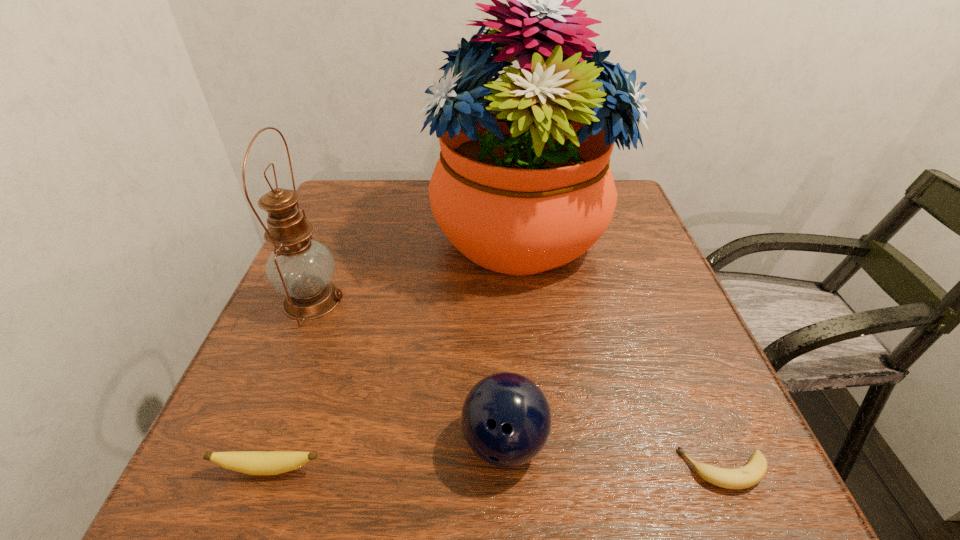
You are a GUI agent. You are given a task and a screenshot of the screen. Output one action in this format:
    pyautogui.click(x=<x>, y=<y>)
    Task: Click on the object located at the near right corner
    The height and width of the screenshot is (540, 960).
    Given the screenshot: What is the action you would take?
    pyautogui.click(x=753, y=472)

At what (x,y) coordinates should I click in order to perform the action: click on free spot at the near edge of the desktop. Please return your answer as a coordinate pair (x, y). The height and width of the screenshot is (540, 960). Looking at the image, I should click on (386, 512).

Where is `free region at the left edge`? Image resolution: width=960 pixels, height=540 pixels. free region at the left edge is located at coordinates (257, 356).

Where is `free space at the right edge of the desktop`? This screenshot has height=540, width=960. free space at the right edge of the desktop is located at coordinates (660, 298).

What are the coordinates of `vacant space at the far left corner` in the screenshot? It's located at (357, 211).

I want to click on vacant area that lies between the oil lamp and the flower arrangement, so click(x=417, y=267).

In order to click on blank region between the fourth shortest object and the third shortest object in this screenshot , I will do `click(408, 371)`.

The image size is (960, 540). Find the location of `vacant space in between the third tallest object and the taller banana`. vacant space in between the third tallest object and the taller banana is located at coordinates (387, 455).

This screenshot has width=960, height=540. In order to click on vacant space that's between the left banana and the bowling ball in this screenshot , I will do `click(387, 455)`.

Where is `free space between the third tallest object and the shortest object`? free space between the third tallest object and the shortest object is located at coordinates (614, 456).